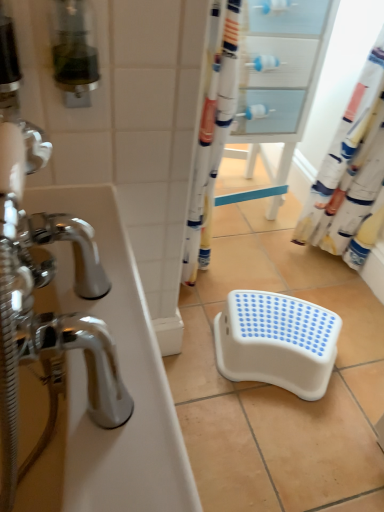
Question: Is white fabric shower curtain at right smaller than white plastic step stool at center?

Choices:
 (A) yes
 (B) no

Answer: (B)

Question: From a real-world perspective, is white fabric shower curtain at right on white plastic step stool at center?

Choices:
 (A) yes
 (B) no

Answer: (A)

Question: Can you confirm if white fabric shower curtain at right is taller than white plastic step stool at center?

Choices:
 (A) no
 (B) yes

Answer: (B)

Question: Is white fabric shower curtain at right looking in the opposite direction of white plastic step stool at center?

Choices:
 (A) yes
 (B) no

Answer: (B)

Question: Does white fabric shower curtain at right touch white plastic step stool at center?

Choices:
 (A) no
 (B) yes

Answer: (A)

Question: Considering the relative sizes of white fabric shower curtain at right and white plastic step stool at center in the image provided, is white fabric shower curtain at right thinner than white plastic step stool at center?

Choices:
 (A) yes
 (B) no

Answer: (A)

Question: Does white plastic step stool at center have a greater height compared to white glossy bathtub at left?

Choices:
 (A) yes
 (B) no

Answer: (B)

Question: From the image's perspective, is white plastic step stool at center on top of white glossy bathtub at left?

Choices:
 (A) yes
 (B) no

Answer: (B)

Question: Is the depth of white plastic step stool at center greater than that of white glossy bathtub at left?

Choices:
 (A) yes
 (B) no

Answer: (A)

Question: From a real-world perspective, is white plastic step stool at center under white glossy bathtub at left?

Choices:
 (A) yes
 (B) no

Answer: (A)

Question: Considering the relative sizes of white plastic step stool at center and white glossy bathtub at left in the image provided, is white plastic step stool at center wider than white glossy bathtub at left?

Choices:
 (A) yes
 (B) no

Answer: (A)

Question: From the image's perspective, would you say white plastic step stool at center is shown under white glossy bathtub at left?

Choices:
 (A) yes
 (B) no

Answer: (A)

Question: Is white glossy bathtub at left to the right of white plastic step stool at center from the viewer's perspective?

Choices:
 (A) no
 (B) yes

Answer: (A)